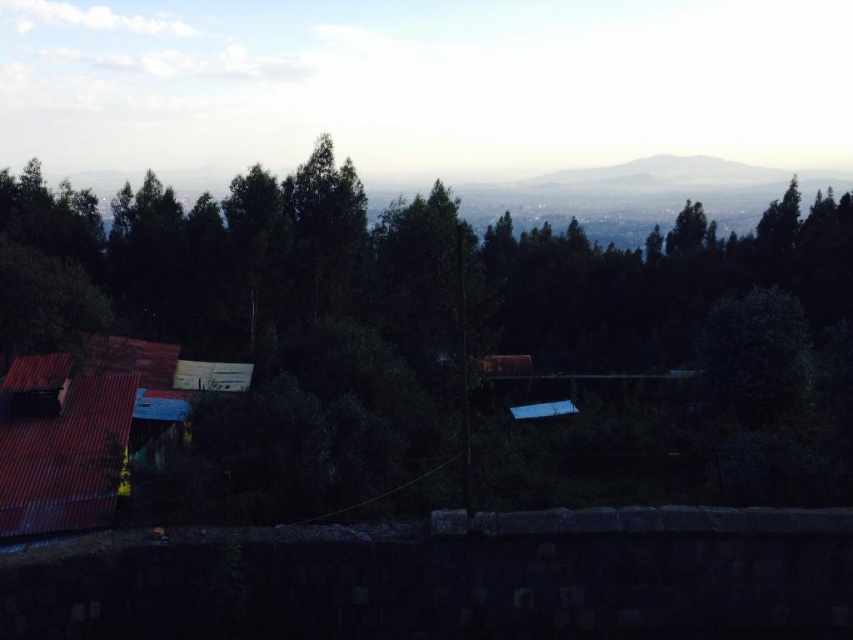
You are a hiker trying to navigate through the scene. You need to decide whether to walk through the green leafy forest at center or around the rusty corrugated metal hut at lower left. Which path would be wider?

The green leafy forest at center is wider than the rusty corrugated metal hut at lower left, so the path through the green leafy forest at center is wider.

Looking at this image, you are standing at the point with coordinates point (x=64, y=467) and want to walk towards the point with coordinates point (x=276, y=237). Based on the scene description, will the stone wall block your path?

Point (x=276, y=237) is behind point (x=64, y=467), so the stone wall at the foreground would block your path towards point (x=276, y=237).

You are planning to build a small garden between the green leafy forest at center and the rusty corrugated metal hut at lower left. Which area would you choose for the garden to ensure it is more visible from the main path that runs along the lower edge of the scene?

The rusty corrugated metal hut at lower left is smaller in size compared to the green leafy forest at center, so placing the garden near the rusty corrugated metal hut at lower left would make it more visible from the main path along the lower edge since the smaller structure would not overshadow the garden as much as the larger forest area.